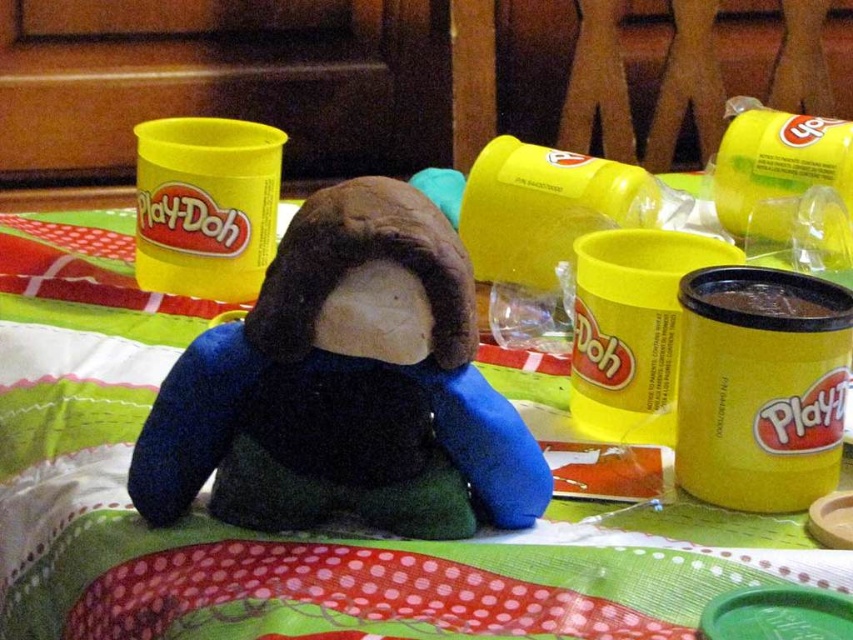
What are the coordinates of the polka dot fabric at center?

The polka dot fabric at center is located at point [314,534].